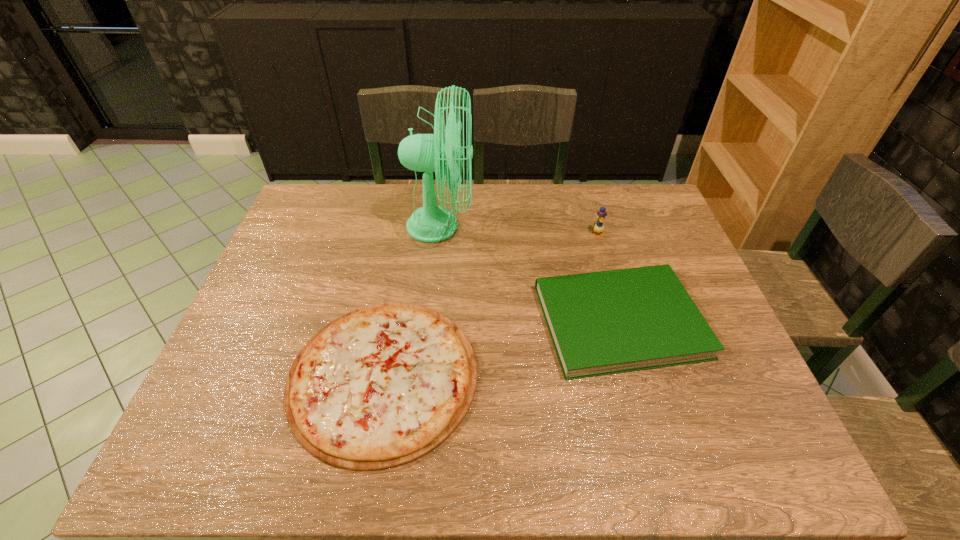
I want to click on object that is at the right edge, so click(608, 322).

This screenshot has height=540, width=960. Find the location of `vacant space at the far edge of the desktop`. vacant space at the far edge of the desktop is located at coordinates (490, 211).

This screenshot has height=540, width=960. In the image, there is a desktop. What are the coordinates of `vacant space at the near edge` in the screenshot? It's located at (563, 445).

Find the location of a particular element. vacant region at the left edge of the desktop is located at coordinates (317, 246).

What are the coordinates of `vacant area at the right edge of the desktop` in the screenshot? It's located at (726, 406).

In the image, there is a desktop. Identify the location of vacant space at the far left corner. The image size is (960, 540). (x=340, y=224).

This screenshot has width=960, height=540. In order to click on vacant space at the far right corner of the desktop in this screenshot , I will do `click(640, 194)`.

Identify the location of free space between the fan and the second tallest object. The height and width of the screenshot is (540, 960). (518, 230).

You are a GUI agent. You are given a task and a screenshot of the screen. Output one action in this format:
    pyautogui.click(x=<x>, y=<y>)
    Task: Click on the blank region between the shortest object and the duckling
    The image size is (960, 540).
    Given the screenshot: What is the action you would take?
    pyautogui.click(x=491, y=305)

Where is `blank region between the tallest object and the second shortest object`? The image size is (960, 540). blank region between the tallest object and the second shortest object is located at coordinates (530, 274).